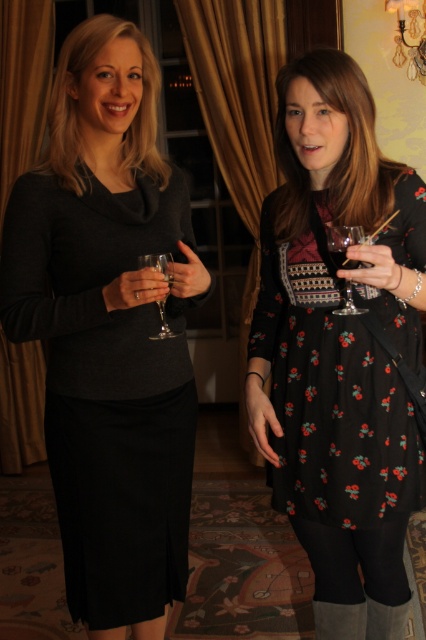
Question: Which of the following is the farthest from the observer?

Choices:
 (A) (353, 636)
 (B) (342, 264)

Answer: (A)

Question: Does matte black dress at center appear under clear glass at center?

Choices:
 (A) no
 (B) yes

Answer: (B)

Question: Among these objects, which one is nearest to the camera?

Choices:
 (A) printed cotton dress at center
 (B) matte black dress at center
 (C) leather boot at lower right
 (D) clear glass wine glass at center

Answer: (A)

Question: From the image, what is the correct spatial relationship of matte black dress at center in relation to transparent glass at right?

Choices:
 (A) left
 (B) right

Answer: (A)

Question: Which point is farther to the camera?

Choices:
 (A) (316, 616)
 (B) (339, 248)
 (C) (77, 168)
 (D) (393, 488)

Answer: (A)

Question: Is matte black dress at center above transparent glass at right?

Choices:
 (A) yes
 (B) no

Answer: (B)